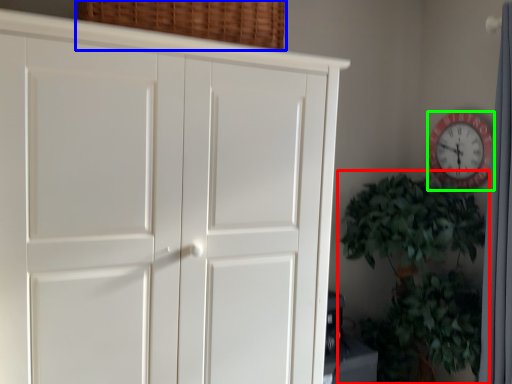
Question: Estimate the real-world distances between objects in this image. Which object is closer to houseplant (highlighted by a red box), basket (highlighted by a blue box) or wall clock (highlighted by a green box)?

Choices:
 (A) basket
 (B) wall clock

Answer: (B)